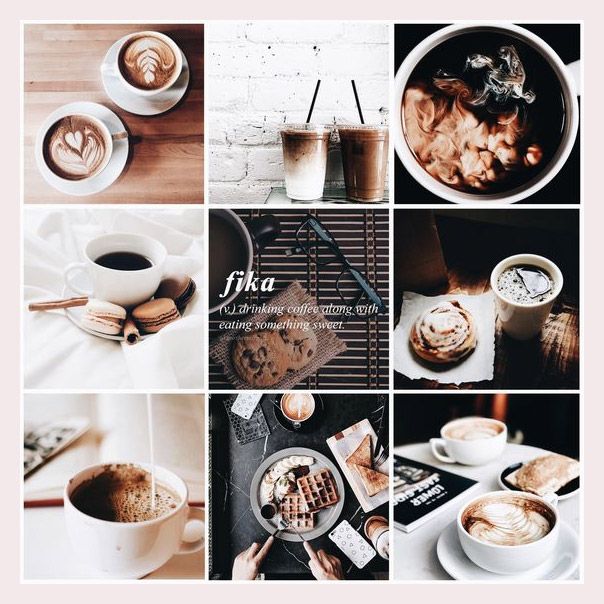
Locate an element on the screen. This screenshot has height=604, width=604. fully or partially visible cup handles is located at coordinates (68, 265), (196, 511), (434, 448), (550, 496), (574, 72).